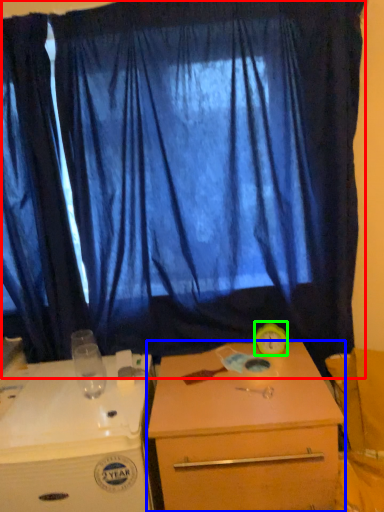
Question: Estimate the real-world distances between objects in this image. Which object is closer to curtain (highlighted by a red box), desk (highlighted by a blue box) or alarm clock (highlighted by a green box)?

Choices:
 (A) desk
 (B) alarm clock

Answer: (A)